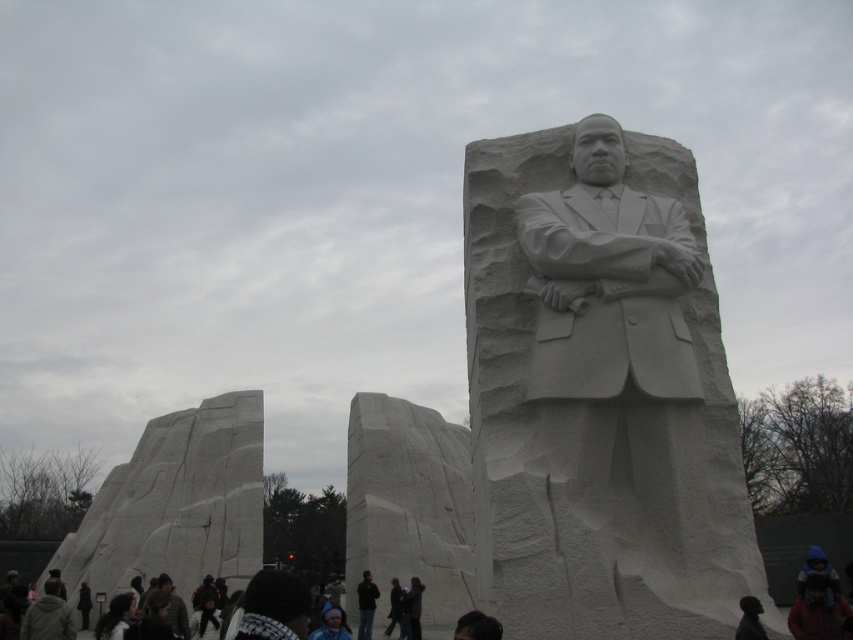
Consider the image. Can you confirm if black matte jacket at center is positioned below dark clothing at lower center?

No, black matte jacket at center is not below dark clothing at lower center.

Is black matte jacket at center further to camera compared to dark clothing at lower center?

No, it is in front of dark clothing at lower center.

Between point (378, 593) and point (387, 620), which one is positioned behind?

Point (387, 620)

You are a GUI agent. You are given a task and a screenshot of the screen. Output one action in this format:
    pyautogui.click(x=<x>, y=<y>)
    Task: Click on the black matte jacket at center
    The height and width of the screenshot is (640, 853).
    Given the screenshot: What is the action you would take?
    pyautogui.click(x=366, y=604)

Is point (676, 268) behind point (6, 573)?

No, (676, 268) is in front of (6, 573).

Is white marble statue at center positioned behind dark clothing at lower center?

No, white marble statue at center is closer to the viewer.

Measure the distance between point (701, 516) and camera.

Point (701, 516) and camera are 41.53 meters apart.

You are a GUI agent. You are given a task and a screenshot of the screen. Output one action in this format:
    pyautogui.click(x=<x>, y=<y>)
    Task: Click on the white marble statue at center
    
    Given the screenshot: What is the action you would take?
    pyautogui.click(x=601, y=392)

Is white marble stone at left wider than black matte jacket at center?

Yes.

Does point (144, 490) come farther from viewer compared to point (373, 592)?

Yes, point (144, 490) is farther from viewer.

The image size is (853, 640). In order to click on white marble stone at left in this screenshot , I will do pyautogui.click(x=177, y=502).